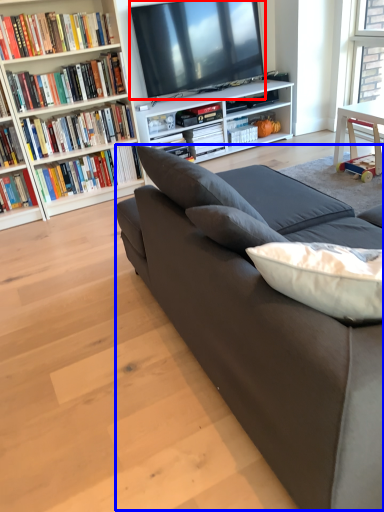
Question: Which point is further to the camera, television (highlighted by a red box) or couch (highlighted by a blue box)?

Choices:
 (A) television
 (B) couch

Answer: (A)